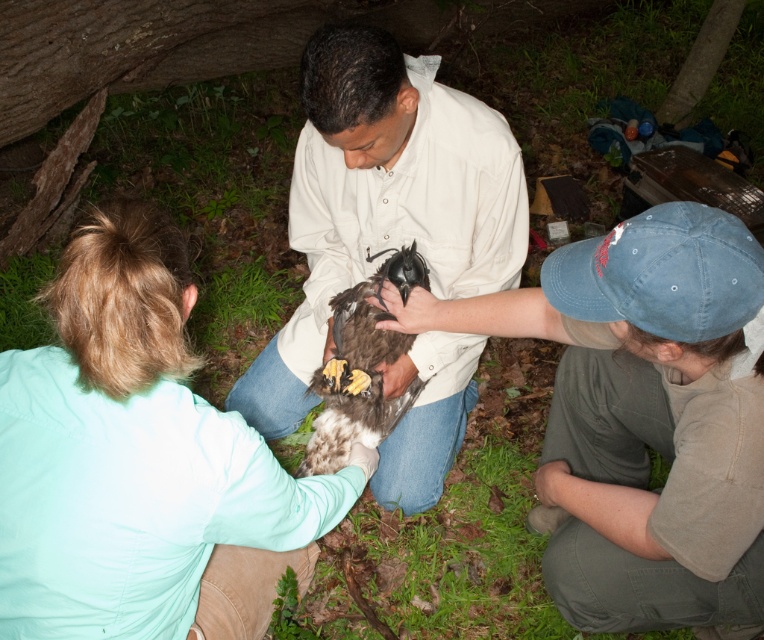
You are a wildlife photographer observing the scene. You need to position yourself so that you can capture both the light blue shirt at center and the smooth beige shirt at center in the same frame. Which person should you stand closer to in order to include both in your shot?

You should stand closer to the light blue shirt at center because it is shorter than the smooth beige shirt at center, allowing you to frame both effectively by adjusting your angle or distance.

You are a wildlife photographer aiming to capture a clear photo of the brown speckled feathers at center without including the light blue shirt at center in the frame. Is it possible to adjust your camera angle to achieve this?

The light blue shirt at center is taller than brown speckled feathers at center, so tilting the camera downward might allow you to exclude the light blue shirt at center while focusing on the brown speckled feathers at center.

Looking at this image, you are a wildlife photographer aiming to capture a clear photo of the brown feathered hawk at center without any obstruction. Based on the scene, is the light blue shirt at center blocking your view of the hawk?

Yes, the light blue shirt at center is in front of the brown feathered hawk at center, so it is blocking the view of the hawk.